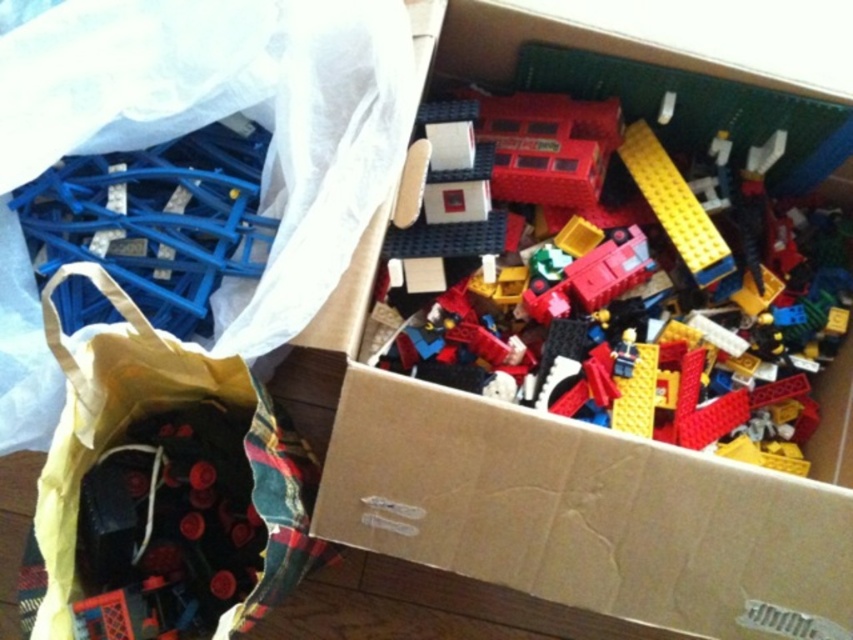
You are looking at the cardboard box with Lego pieces and the plastic bag with more parts. There are two points marked in the image, one at coordinates point (525, 483) and another at point (97, 416). Which point is closer to you?

Point (525, 483) is closer to the camera than point (97, 416).

You are organizing a Lego collection and need to move items from the cardboard box at upper center to the black fabric bag at lower left. Based on their positions, which container is closer to the edge of the table?

The black fabric bag at lower left is closer to the edge of the table since it is positioned below the cardboard box at upper center, which is above it.